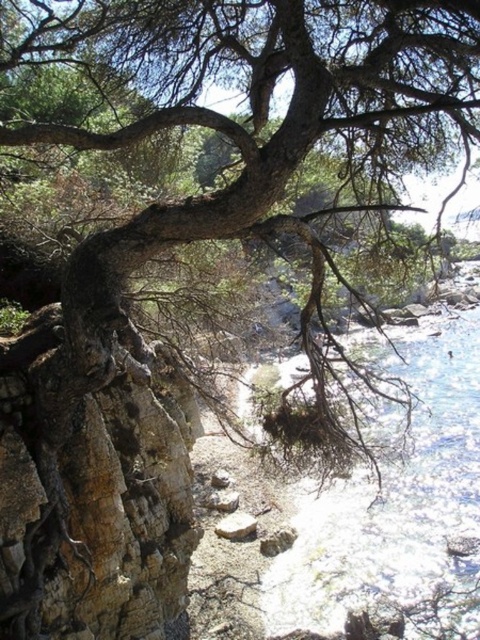
You are standing on the gray rough stone at center and want to cross to the clear blue water at lower right. Given that your height is 1.7 meters, can you step over the gap between them?

The clear blue water at lower right is much taller than the gray rough stone at center. Since the water is higher, you would need to climb upwards, but the exact height difference isn not specified. However, since you are 1.7 meters tall, it might be challenging without assistance. The answer is uncertain based on the provided information.

You are a hiker who wants to cross from the gray rough stone at center to the clear blue water at lower right. Which direction should you move to reach the water?

The clear blue water at lower right is located to the right of the gray rough stone at center, so you should move towards the right direction to reach the water.